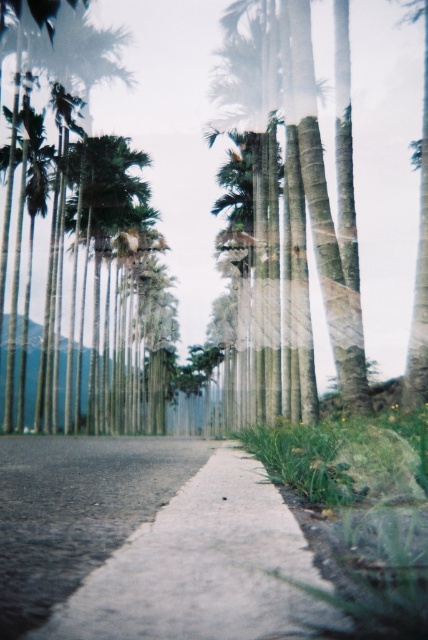
Question: Among these points, which one is nearest to the camera?

Choices:
 (A) (128, 208)
 (B) (65, 438)

Answer: (B)

Question: Is gray concrete pavement at center to the left of green leafy palm tree at center from the viewer's perspective?

Choices:
 (A) yes
 (B) no

Answer: (B)

Question: Is gray concrete pavement at center thinner than green leafy palm tree at center?

Choices:
 (A) yes
 (B) no

Answer: (B)

Question: Which point is farther from the camera taking this photo?

Choices:
 (A) (92, 246)
 (B) (59, 513)

Answer: (A)

Question: Which point is farther to the camera?

Choices:
 (A) green leafy palm tree at center
 (B) gray concrete pavement at center

Answer: (A)

Question: Does gray concrete pavement at center have a lesser width compared to green leafy palm tree at center?

Choices:
 (A) yes
 (B) no

Answer: (B)